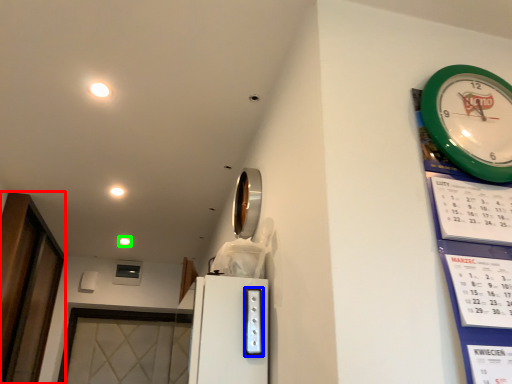
Question: Based on their relative distances, which object is nearer to glass door (highlighted by a red box)? Choose from appliance (highlighted by a blue box) and light (highlighted by a green box).

Choices:
 (A) appliance
 (B) light

Answer: (B)